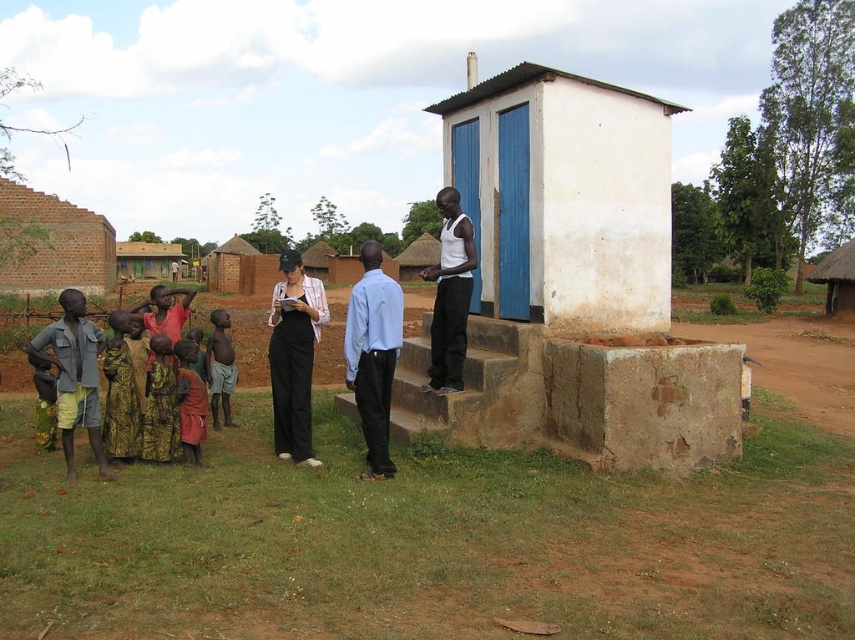
Is brick wall at left wider than brown mud hut at left?

In fact, brick wall at left might be narrower than brown mud hut at left.

Based on the photo, is brick wall at left below brown mud hut at left?

Correct, brick wall at left is located below brown mud hut at left.

Between point (74, 285) and point (140, 244), which one is positioned behind?

The point (140, 244) is more distant.

Find the location of `brick wall at left`. brick wall at left is located at coordinates (51, 243).

Between brown dirt field at lower left and light brown skin at center, which one is positioned higher?

Positioned higher is light brown skin at center.

Is brown dirt field at lower left to the left of light brown skin at center from the viewer's perspective?

No, brown dirt field at lower left is not to the left of light brown skin at center.

Who is more forward, [239,554] or [217,332]?

Point [239,554]

Image resolution: width=855 pixels, height=640 pixels. Find the location of `brown dirt field at lower left`. brown dirt field at lower left is located at coordinates (428, 541).

Describe the element at coordinates (293, 356) in the screenshot. This screenshot has height=640, width=855. I see `black fabric pants at center` at that location.

Can you confirm if black fabric pants at center is shorter than thatched roof hut at upper right?

Yes.

Is point (276, 344) less distant than point (821, 262)?

Yes, it is.

I want to click on black fabric pants at center, so click(293, 356).